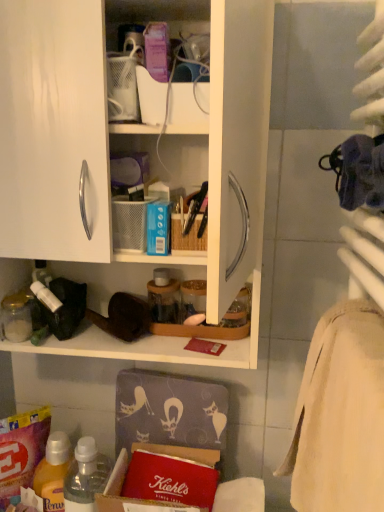
The image size is (384, 512). I want to click on matte plastic container at upper center, so click(189, 108).

In the scene shown: What is the approximate width of beige cotton bath towel at right?

beige cotton bath towel at right is 4.65 inches wide.

Find the location of a particular element. This screenshot has width=384, height=512. translucent plastic bottle at lower left is located at coordinates (86, 476).

Is white matte cabinet at upper left wider than beige cotton bath towel at right?

Yes.

Based on the photo, considering the positions of objects white matte cabinet at upper left and beige cotton bath towel at right in the image provided, who is more to the right, white matte cabinet at upper left or beige cotton bath towel at right?

From the viewer's perspective, beige cotton bath towel at right appears more on the right side.

From the image's perspective, is white matte cabinet at upper left located above or below beige cotton bath towel at right?

white matte cabinet at upper left is situated higher than beige cotton bath towel at right in the image.

Consider the image. How much distance is there between beige cotton bath towel at right and translucent plastic bottle at lower left?

They are 20.09 inches apart.

From the image's perspective, is beige cotton bath towel at right above or below translucent plastic bottle at lower left?

Clearly, from the image's perspective, beige cotton bath towel at right is above translucent plastic bottle at lower left.

The width and height of the screenshot is (384, 512). I want to click on bath towel to the right of translucent plastic bottle at lower left, so click(340, 415).

Consider the image. Which object is further away from the camera, beige cotton bath towel at right or translucent plastic bottle at lower left?

Positioned behind is translucent plastic bottle at lower left.

Is beige cotton bath towel at right far away from white matte cabinet at upper left?

beige cotton bath towel at right is near white matte cabinet at upper left, not far away.

How different are the orientations of beige cotton bath towel at right and white matte cabinet at upper left in degrees?

86.2 degrees separate the facing orientations of beige cotton bath towel at right and white matte cabinet at upper left.

From the image's perspective, between beige cotton bath towel at right and white matte cabinet at upper left, who is located below?

beige cotton bath towel at right, from the image's perspective.

This screenshot has height=512, width=384. I want to click on bath towel on the right of white matte cabinet at upper left, so click(340, 415).

Can you confirm if white matte cabinet at upper left is positioned to the right of translucent plastic bottle at lower left?

Indeed, white matte cabinet at upper left is positioned on the right side of translucent plastic bottle at lower left.

Is white matte cabinet at upper left wider or thinner than translucent plastic bottle at lower left?

white matte cabinet at upper left is wider than translucent plastic bottle at lower left.

This screenshot has height=512, width=384. Find the location of `bottle behind the white matte cabinet at upper left`. bottle behind the white matte cabinet at upper left is located at coordinates (86, 476).

From a real-world perspective, relative to translucent plastic bottle at lower left, is white matte cabinet at upper left vertically above or below?

white matte cabinet at upper left is above translucent plastic bottle at lower left.

Who is more distant, beige cotton bath towel at right or matte plastic container at upper center?

matte plastic container at upper center is behind.

From the image's perspective, is beige cotton bath towel at right located above or below matte plastic container at upper center?

From the image's perspective, beige cotton bath towel at right appears below matte plastic container at upper center.

Does beige cotton bath towel at right contain matte plastic container at upper center?

No, matte plastic container at upper center is located outside of beige cotton bath towel at right.

Between beige cotton bath towel at right and matte plastic container at upper center, which one appears on the right side from the viewer's perspective?

beige cotton bath towel at right.

What's the angular difference between matte plastic container at upper center and beige cotton bath towel at right's facing directions?

The facing directions of matte plastic container at upper center and beige cotton bath towel at right are 87.3 degrees apart.

In the scene shown: Is matte plastic container at upper center taller or shorter than beige cotton bath towel at right?

Considering their sizes, matte plastic container at upper center has less height than beige cotton bath towel at right.

Does matte plastic container at upper center have a greater width compared to beige cotton bath towel at right?

In fact, matte plastic container at upper center might be narrower than beige cotton bath towel at right.

Is matte plastic container at upper center oriented away from beige cotton bath towel at right?

matte plastic container at upper center is not turned away from beige cotton bath towel at right.

Can you confirm if matte plastic container at upper center is thinner than white matte cabinet at upper left?

Indeed, matte plastic container at upper center has a lesser width compared to white matte cabinet at upper left.

Is matte plastic container at upper center looking in the opposite direction of white matte cabinet at upper left?

Absolutely, matte plastic container at upper center is directed away from white matte cabinet at upper left.

Does matte plastic container at upper center have a lesser height compared to white matte cabinet at upper left?

Yes.

Do you think matte plastic container at upper center is within white matte cabinet at upper left, or outside of it?

matte plastic container at upper center is spatially positioned inside white matte cabinet at upper left.

This screenshot has width=384, height=512. I want to click on bath towel in front of the white matte cabinet at upper left, so click(340, 415).

The width and height of the screenshot is (384, 512). Find the location of `bottle behind the beige cotton bath towel at right`. bottle behind the beige cotton bath towel at right is located at coordinates (86, 476).

From the image, which object appears to be farther from translucent plastic bottle at lower left, white matte cabinet at upper left or matte plastic container at upper center?

Based on the image, matte plastic container at upper center appears to be further to translucent plastic bottle at lower left.

Estimate the real-world distances between objects in this image. Which object is further from translucent plastic bottle at lower left, matte plastic container at upper center or beige cotton bath towel at right?

matte plastic container at upper center.

Which object lies nearer to the anchor point beige cotton bath towel at right, translucent plastic bottle at lower left or matte plastic container at upper center?

translucent plastic bottle at lower left is positioned closer to the anchor beige cotton bath towel at right.

Which object lies nearer to the anchor point matte plastic container at upper center, beige cotton bath towel at right or white matte cabinet at upper left?

The object closer to matte plastic container at upper center is white matte cabinet at upper left.

Considering their positions, is white matte cabinet at upper left positioned closer to translucent plastic bottle at lower left than beige cotton bath towel at right?

Based on the image, beige cotton bath towel at right appears to be nearer to translucent plastic bottle at lower left.

Which object lies further to the anchor point matte plastic container at upper center, translucent plastic bottle at lower left or beige cotton bath towel at right?

Among the two, translucent plastic bottle at lower left is located further to matte plastic container at upper center.

Looking at this image, when comparing their distances from beige cotton bath towel at right, does translucent plastic bottle at lower left or white matte cabinet at upper left seem further?

Based on the image, translucent plastic bottle at lower left appears to be further to beige cotton bath towel at right.

Which object lies further to the anchor point beige cotton bath towel at right, white matte cabinet at upper left or translucent plastic bottle at lower left?

translucent plastic bottle at lower left lies further to beige cotton bath towel at right than the other object.

Identify the location of cabinetry that lies between matte plastic container at upper center and translucent plastic bottle at lower left from top to bottom. The width and height of the screenshot is (384, 512). (108, 156).

Find the location of a particular element. This screenshot has height=512, width=384. bath towel between white matte cabinet at upper left and translucent plastic bottle at lower left vertically is located at coordinates (340, 415).

I want to click on bath towel between matte plastic container at upper center and translucent plastic bottle at lower left in the up-down direction, so (x=340, y=415).

Image resolution: width=384 pixels, height=512 pixels. I want to click on cabinetry that lies between matte plastic container at upper center and beige cotton bath towel at right from top to bottom, so click(108, 156).